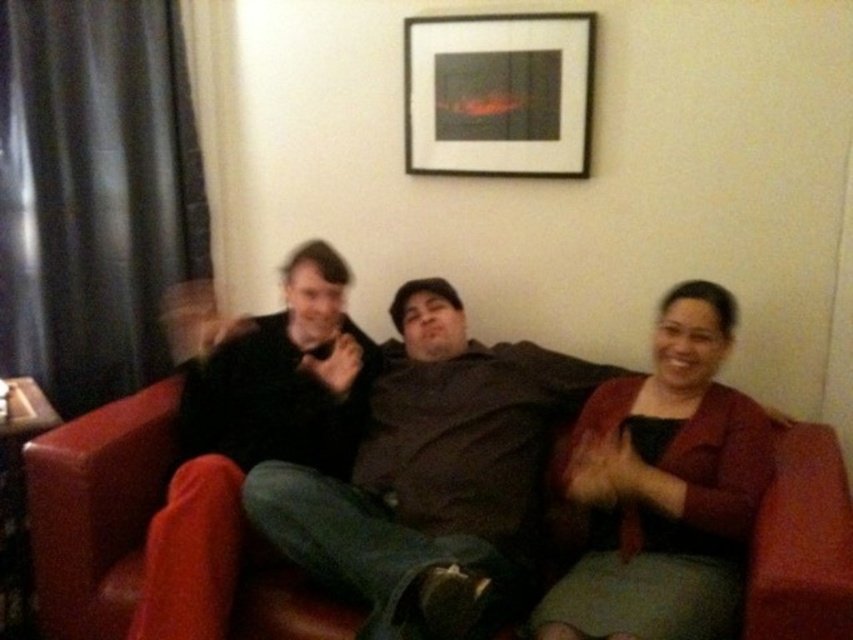
Between matte red sweater at center and matte black jacket at center, which one appears on the left side from the viewer's perspective?

matte black jacket at center

Does matte red sweater at center have a greater height compared to matte black jacket at center?

In fact, matte red sweater at center may be shorter than matte black jacket at center.

You are a GUI agent. You are given a task and a screenshot of the screen. Output one action in this format:
    pyautogui.click(x=<x>, y=<y>)
    Task: Click on the matte red sweater at center
    
    Given the screenshot: What is the action you would take?
    pyautogui.click(x=664, y=490)

Find the location of `matte red sweater at center`. matte red sweater at center is located at coordinates (664, 490).

Is matte red sweater at center smaller than black matte picture frame at upper center?

No, matte red sweater at center is not smaller than black matte picture frame at upper center.

This screenshot has width=853, height=640. What do you see at coordinates (664, 490) in the screenshot?
I see `matte red sweater at center` at bounding box center [664, 490].

Is point (606, 538) closer to camera compared to point (469, 56)?

Yes, point (606, 538) is in front of point (469, 56).

You are a GUI agent. You are given a task and a screenshot of the screen. Output one action in this format:
    pyautogui.click(x=<x>, y=<y>)
    Task: Click on the matte red sweater at center
    Image resolution: width=853 pixels, height=640 pixels.
    Given the screenshot: What is the action you would take?
    pyautogui.click(x=664, y=490)

Is dark brown sweater at center wider than matte black jacket at center?

No, dark brown sweater at center is not wider than matte black jacket at center.

Measure the distance from dark brown sweater at center to matte black jacket at center.

dark brown sweater at center is 10.18 inches away from matte black jacket at center.

Locate an element on the screen. The height and width of the screenshot is (640, 853). dark brown sweater at center is located at coordinates (422, 483).

At what (x,y) coordinates should I click in order to perform the action: click on dark brown sweater at center. Please return your answer as a coordinate pair (x, y). Looking at the image, I should click on (422, 483).